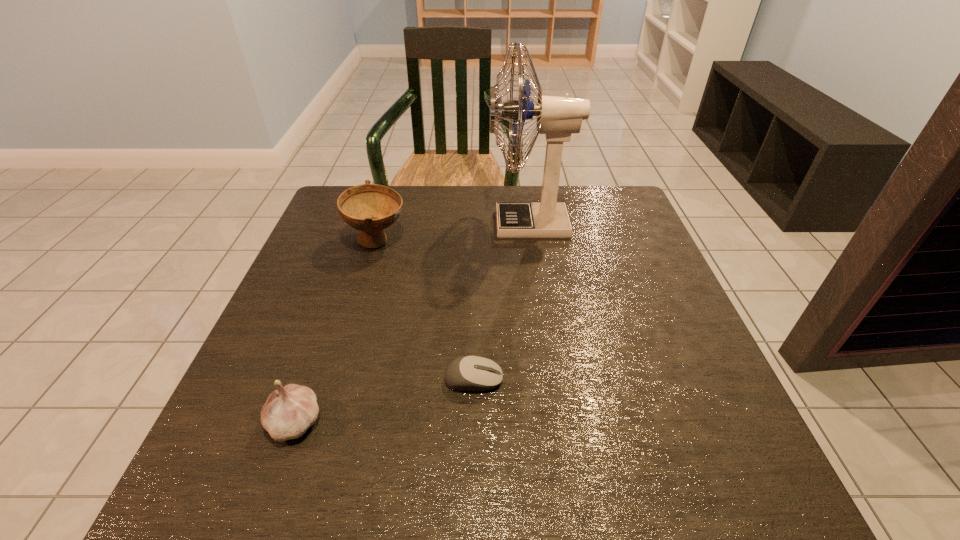
Identify the location of free spot between the tallest object and the soup bowl. Image resolution: width=960 pixels, height=540 pixels. (453, 233).

Locate an element on the screen. The width and height of the screenshot is (960, 540). vacant space that's between the soup bowl and the third farthest object is located at coordinates (425, 310).

In order to click on free space between the nearest object and the tallest object in this screenshot , I will do `click(413, 323)`.

Choose which object is the second nearest neighbor to the third shortest object. Please provide its 2D coordinates. Your answer should be formatted as a tuple, i.e. [(x, y)], where the tuple contains the x and y coordinates of a point satisfying the conditions above.

[(470, 373)]

I want to click on the closest object to the fan, so click(x=370, y=208).

Where is `free region that satisfies the following two spatial constraints: 1. on the front-facing side of the fan; 2. on the front side of the nearest object`? The width and height of the screenshot is (960, 540). free region that satisfies the following two spatial constraints: 1. on the front-facing side of the fan; 2. on the front side of the nearest object is located at coordinates (559, 421).

Image resolution: width=960 pixels, height=540 pixels. I want to click on free region that satisfies the following two spatial constraints: 1. on the wheel side of the computer equipment; 2. on the front side of the garlic, so click(473, 421).

Identify the location of free space that satisfies the following two spatial constraints: 1. on the front-facing side of the tallest object; 2. on the front side of the soup bowl. This screenshot has width=960, height=540. (532, 241).